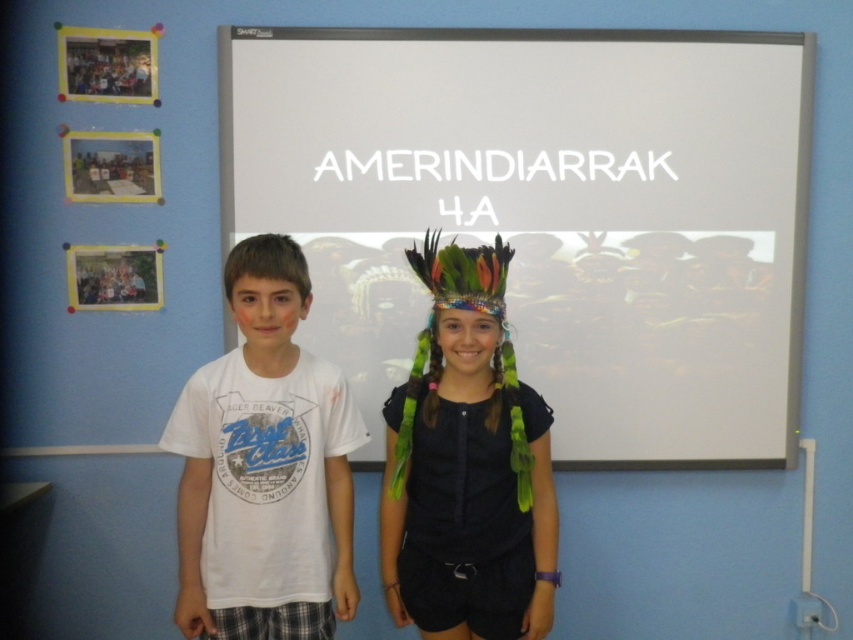
Question: Does white matte projector screen at upper center lie in front of dark blue fabric headdress at center?

Choices:
 (A) no
 (B) yes

Answer: (A)

Question: Is white matte projector screen at upper center to the left of white matte t-shirt at center from the viewer's perspective?

Choices:
 (A) no
 (B) yes

Answer: (A)

Question: Which point is farther to the camera?

Choices:
 (A) (229, 262)
 (B) (490, 310)

Answer: (B)

Question: Which object appears farthest from the camera in this image?

Choices:
 (A) white matte projector screen at upper center
 (B) matte black photo frame at upper left
 (C) white matte t-shirt at center
 (D) dark blue fabric headdress at center

Answer: (B)

Question: Which point is farther to the camera?

Choices:
 (A) white matte t-shirt at center
 (B) matte black photo frame at upper left

Answer: (B)

Question: Does white matte t-shirt at center appear on the left side of matte black photo frame at upper left?

Choices:
 (A) yes
 (B) no

Answer: (B)